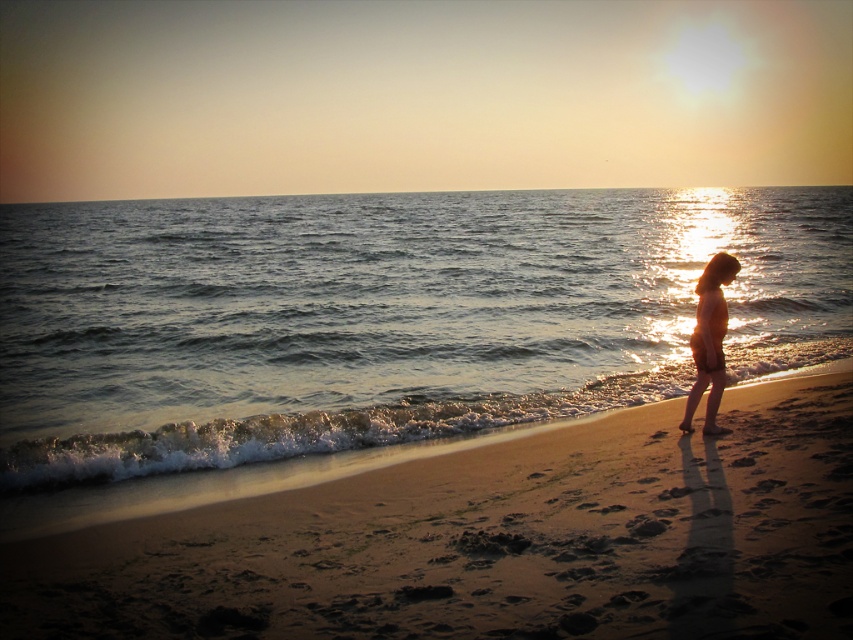
Question: Is shiny blue water at center in front of silhouette skin at right?

Choices:
 (A) yes
 (B) no

Answer: (B)

Question: Is sandy beach at lower right smaller than silhouette skin at right?

Choices:
 (A) no
 (B) yes

Answer: (B)

Question: Which object appears farthest from the camera in this image?

Choices:
 (A) silhouette skin at right
 (B) sandy beach at lower right
 (C) shiny blue water at center

Answer: (C)

Question: Can you confirm if shiny blue water at center is thinner than silhouette skin at right?

Choices:
 (A) yes
 (B) no

Answer: (B)

Question: Which point is farther from the camera taking this photo?

Choices:
 (A) (709, 355)
 (B) (248, 538)
 (C) (9, 300)

Answer: (C)

Question: Which object is closer to the camera taking this photo?

Choices:
 (A) sandy beach at lower right
 (B) silhouette skin at right

Answer: (A)